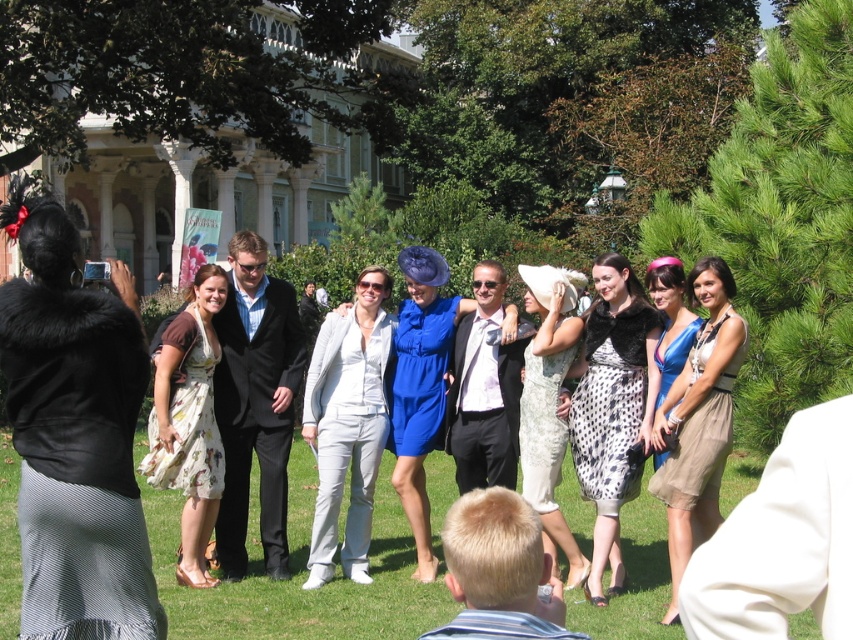
Question: Does dotted fabric dress at center appear on the left side of beige chiffon dress at center?

Choices:
 (A) no
 (B) yes

Answer: (B)

Question: Is the position of beige chiffon dress at center less distant than that of white lace dress at center?

Choices:
 (A) yes
 (B) no

Answer: (A)

Question: Estimate the real-world distances between objects in this image. Which object is closer to the beige chiffon dress at center?

Choices:
 (A) floral print dress at center
 (B) shiny blue dress at center
 (C) light gray suit at center
 (D) white lace dress at center

Answer: (B)

Question: Is white lace dress at center above shiny blue dress at center?

Choices:
 (A) yes
 (B) no

Answer: (B)

Question: Which object is positioned farthest from the floral print dress at center?

Choices:
 (A) black fur coat at left
 (B) beige chiffon dress at center
 (C) white lace dress at center

Answer: (B)

Question: Which point is farther from the camera taking this photo?

Choices:
 (A) (698, 339)
 (B) (308, 628)
 (C) (320, 344)
 (D) (645, 310)

Answer: (C)